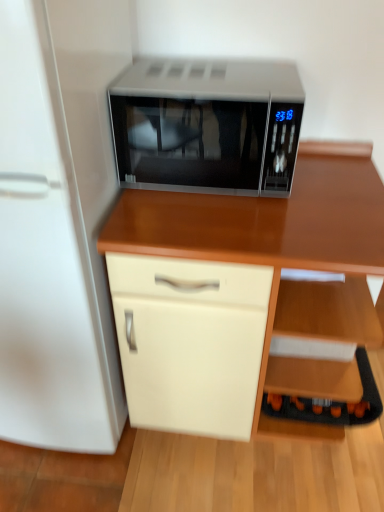
Question: Is white glossy refrigerator at left located outside black plastic shelf at lower right?

Choices:
 (A) yes
 (B) no

Answer: (A)

Question: Is white glossy refrigerator at left turned away from black plastic shelf at lower right?

Choices:
 (A) no
 (B) yes

Answer: (A)

Question: Does white glossy refrigerator at left touch black plastic shelf at lower right?

Choices:
 (A) yes
 (B) no

Answer: (B)

Question: From the image's perspective, is white glossy refrigerator at left on black plastic shelf at lower right?

Choices:
 (A) yes
 (B) no

Answer: (A)

Question: Does white glossy refrigerator at left have a larger size compared to black plastic shelf at lower right?

Choices:
 (A) yes
 (B) no

Answer: (A)

Question: Considering the positions of sleek silver microwave at center and white glossy refrigerator at left in the image, is sleek silver microwave at center taller or shorter than white glossy refrigerator at left?

Choices:
 (A) short
 (B) tall

Answer: (A)

Question: Based on their sizes in the image, would you say sleek silver microwave at center is bigger or smaller than white glossy refrigerator at left?

Choices:
 (A) small
 (B) big

Answer: (A)

Question: Which is correct: sleek silver microwave at center is inside white glossy refrigerator at left, or outside of it?

Choices:
 (A) inside
 (B) outside

Answer: (B)

Question: From the image's perspective, is sleek silver microwave at center located above or below white glossy refrigerator at left?

Choices:
 (A) below
 (B) above

Answer: (B)

Question: In terms of width, does black plastic shelf at lower right look wider or thinner when compared to sleek silver microwave at center?

Choices:
 (A) thin
 (B) wide

Answer: (A)

Question: Is point (344, 308) closer or farther from the camera than point (185, 80)?

Choices:
 (A) closer
 (B) farther

Answer: (B)

Question: Considering the relative positions of black plastic shelf at lower right and sleek silver microwave at center in the image provided, is black plastic shelf at lower right to the left or to the right of sleek silver microwave at center?

Choices:
 (A) right
 (B) left

Answer: (A)

Question: In terms of height, does black plastic shelf at lower right look taller or shorter compared to sleek silver microwave at center?

Choices:
 (A) short
 (B) tall

Answer: (A)

Question: Looking at their shapes, would you say white glossy refrigerator at left is wider or thinner than sleek silver microwave at center?

Choices:
 (A) wide
 (B) thin

Answer: (A)

Question: From a real-world perspective, is white glossy refrigerator at left physically located above or below sleek silver microwave at center?

Choices:
 (A) below
 (B) above

Answer: (A)